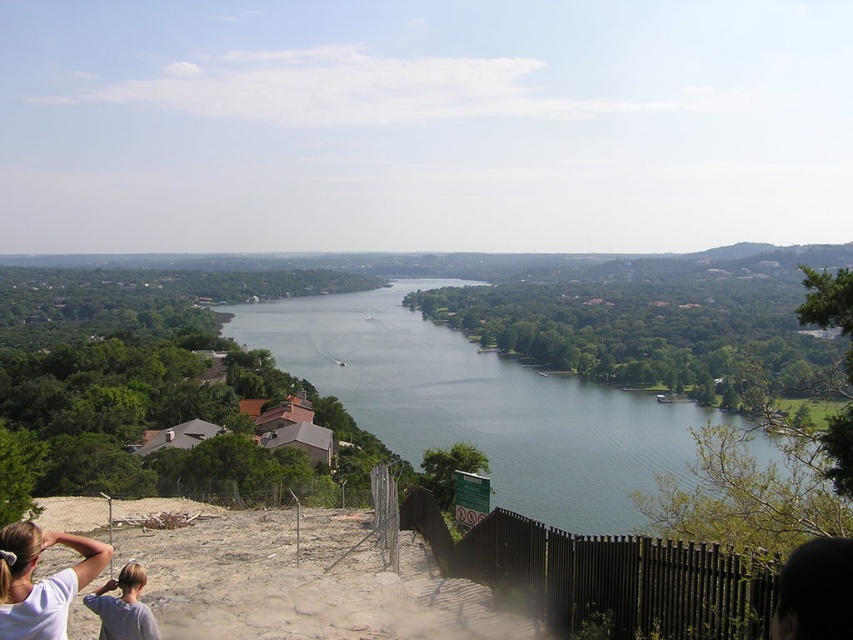
Question: Is green water at center below white matte shirt at lower left?

Choices:
 (A) yes
 (B) no

Answer: (A)

Question: Is green water at center above white matte shirt at lower left?

Choices:
 (A) no
 (B) yes

Answer: (A)

Question: Among these objects, which one is farthest from the camera?

Choices:
 (A) green water at center
 (B) white matte shirt at lower left

Answer: (A)

Question: Does green water at center appear on the left side of white matte shirt at lower left?

Choices:
 (A) yes
 (B) no

Answer: (B)